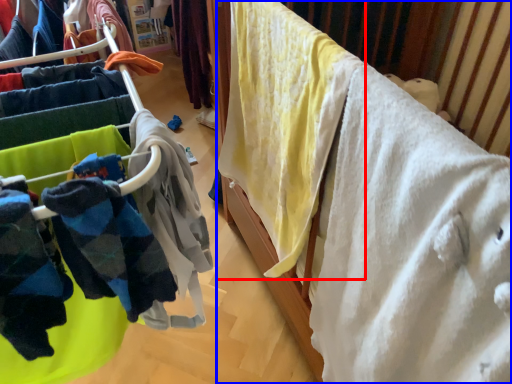
Question: Which object is further to the camera taking this photo, clothing (highlighted by a red box) or furniture (highlighted by a blue box)?

Choices:
 (A) clothing
 (B) furniture

Answer: (A)